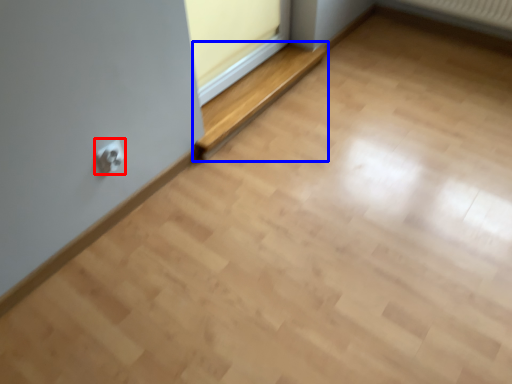
Question: Which of the following is the farthest to the observer, electric outlet (highlighted by a red box) or balustrade (highlighted by a blue box)?

Choices:
 (A) electric outlet
 (B) balustrade

Answer: (B)